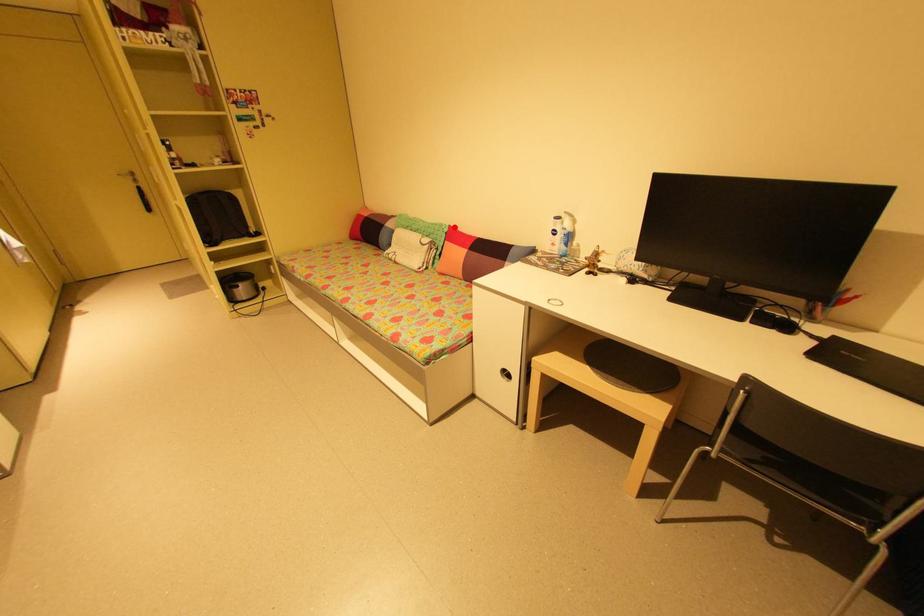
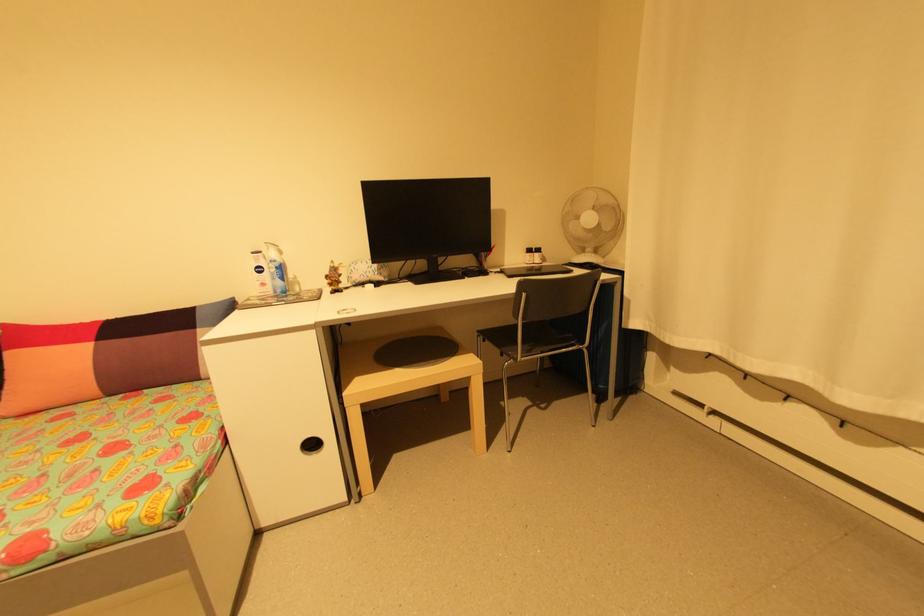
Locate, in the second image, the point that corresponds to the highlighted location in the first image.

(8, 326)